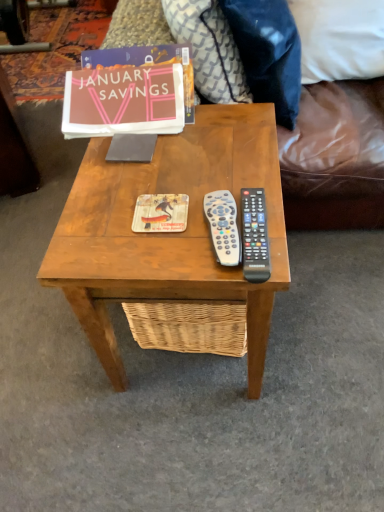
In order to click on free space to the left of wooden coffee table at center in this screenshot , I will do `click(43, 352)`.